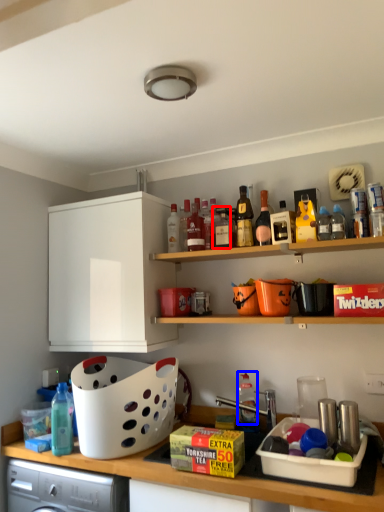
Question: Which object is further to the camera taking this photo, bottle (highlighted by a red box) or bottle (highlighted by a blue box)?

Choices:
 (A) bottle
 (B) bottle

Answer: (B)